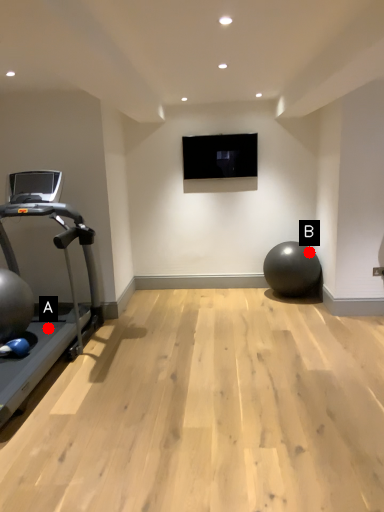
Question: Two points are circled on the image, labeled by A and B beside each circle. Which point appears closest to the camera in this image?

Choices:
 (A) A is closer
 (B) B is closer

Answer: (A)